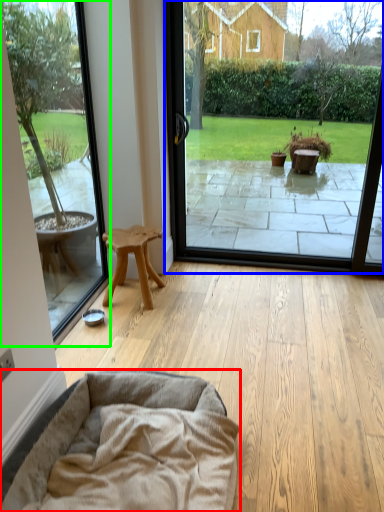
Question: Which is nearer to the dog bed (highlighted by a red box)? window screen (highlighted by a blue box) or window screen (highlighted by a green box).

Choices:
 (A) window screen
 (B) window screen

Answer: (B)